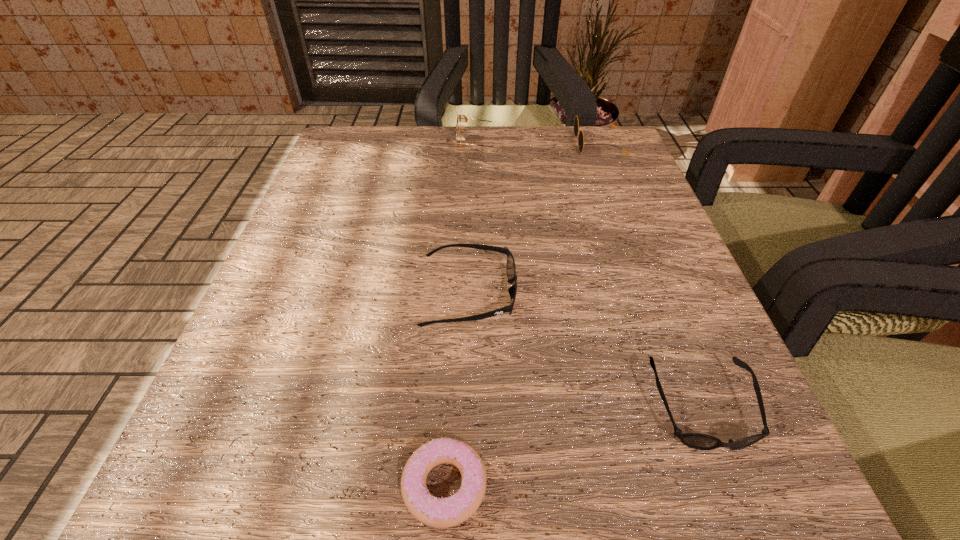
The height and width of the screenshot is (540, 960). In order to click on sunglasses at the near edge in this screenshot , I will do `click(697, 441)`.

Where is `doughnut at the near edge`? Image resolution: width=960 pixels, height=540 pixels. doughnut at the near edge is located at coordinates (436, 512).

The image size is (960, 540). In order to click on object located at the far right corner in this screenshot , I will do pos(581,144).

Where is `object at the near right corner`? The height and width of the screenshot is (540, 960). object at the near right corner is located at coordinates (697, 441).

The width and height of the screenshot is (960, 540). What are the coordinates of `free point at the far edge` in the screenshot? It's located at (530, 139).

You are a GUI agent. You are given a task and a screenshot of the screen. Output one action in this format:
    pyautogui.click(x=<x>, y=<y>)
    Task: Click on the vacant area at the left edge
    The image size is (960, 540).
    Given the screenshot: What is the action you would take?
    pyautogui.click(x=300, y=327)

In the image, there is a desktop. Identify the location of free space at the right edge. (613, 205).

In order to click on blank space at the far left corner of the desktop in this screenshot , I will do `click(399, 143)`.

What are the coordinates of `vacant area at the near left corner of the desktop` in the screenshot? It's located at 243,496.

Find the location of a particular element. The width and height of the screenshot is (960, 540). vacant space at the far right corner is located at coordinates (632, 151).